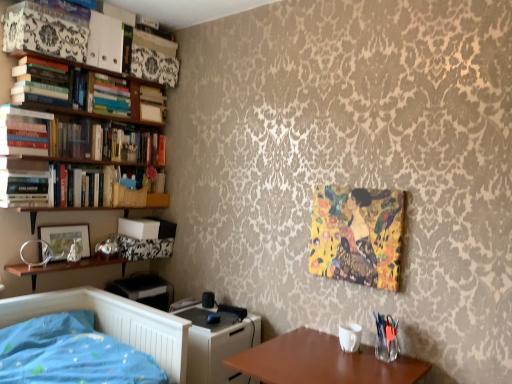
Question: Which is correct: hardcover books at left, which is the 2th book in bottom-to-top order, is inside hardcover books at upper left, which is the fourth book from bottom to top, or outside of it?

Choices:
 (A) outside
 (B) inside

Answer: (A)

Question: From the image's perspective, is hardcover books at left, placed as the 5th book when sorted from top to bottom, positioned above or below hardcover books at upper left, acting as the 3th book starting from the top?

Choices:
 (A) below
 (B) above

Answer: (A)

Question: Which object is the farthest from the matte wood shelf at upper left?

Choices:
 (A) hardcover books at left, which appears as the second book when viewed from the top
 (B) hardcover book at left, which appears as the first book when ordered from the bottom
 (C) hardcover books at left, which is counted as the 3th book, starting from the bottom
 (D) metallic silver picture frame at left
 (E) hardcover books at left, placed as the 5th book when sorted from top to bottom

Answer: (D)

Question: Which object is positioned closest to the metallic silver picture frame at left?

Choices:
 (A) hardcover books at left, which appears as the second book when viewed from the top
 (B) white plastic/file cabinet at lower center
 (C) wooden table at lower right
 (D) hardcover books at left, which is counted as the 3th book, starting from the bottom
 (E) hardcover books at left, placed as the 5th book when sorted from top to bottom

Answer: (E)